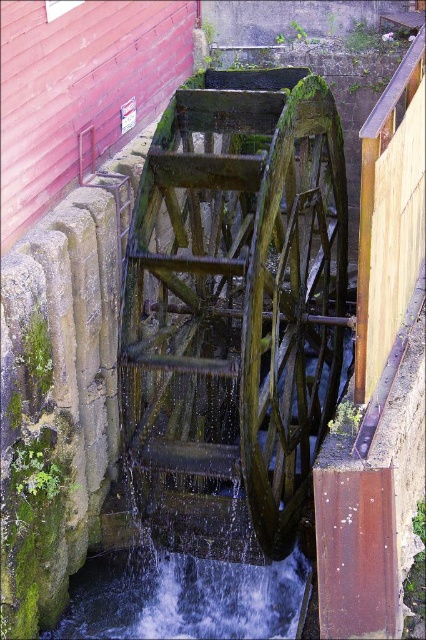
Looking at this image, you are an engineer inspecting the waterwheel structure. You need to compare the width of the green mossy wood at center and the green mossy wood wheel at center. Which one is wider?

The green mossy wood at center is wider than the green mossy wood wheel at center according to the description provided.

You are a maintenance worker tasked with repairing the green mossy wood at center and the green mossy wood wheel at center. You have a ladder that is 1 meter long. Can you use this ladder to reach both objects without moving it?

The distance between the green mossy wood at center and the green mossy wheel at center is 1.12 meters. Since the ladder is only 1 meter long, it is not long enough to span the gap between them. Therefore, you would need to move the ladder to reach both objects separately.

You are a maintenance worker inspecting the waterwheel. You notice two parts labeled as green mossy wood at center and green mossy wood wheel at center. Which part is positioned higher up?

The green mossy wood at center is positioned higher up than the green mossy wood wheel at center.